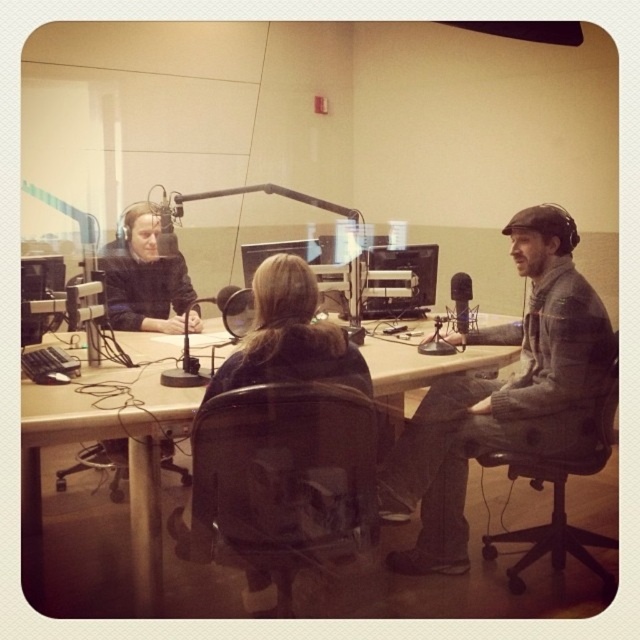
Question: Is wooden table at center positioned before matte black headphones at left?

Choices:
 (A) no
 (B) yes

Answer: (B)

Question: Which object appears closest to the camera in this image?

Choices:
 (A) textured gray jacket at right
 (B) matte black microphone at center
 (C) wooden table at center
 (D) matte black headphones at left

Answer: (C)

Question: Is matte black headphones at left further to the viewer compared to matte black microphone at center?

Choices:
 (A) yes
 (B) no

Answer: (A)

Question: Which point is farther to the camera?

Choices:
 (A) matte black headphones at left
 (B) matte black microphone at center
 (C) textured gray jacket at right

Answer: (A)

Question: Is textured gray jacket at right positioned in front of matte black microphone at center?

Choices:
 (A) no
 (B) yes

Answer: (B)

Question: Which of the following is the farthest from the observer?

Choices:
 (A) (461, 284)
 (B) (448, 541)

Answer: (A)